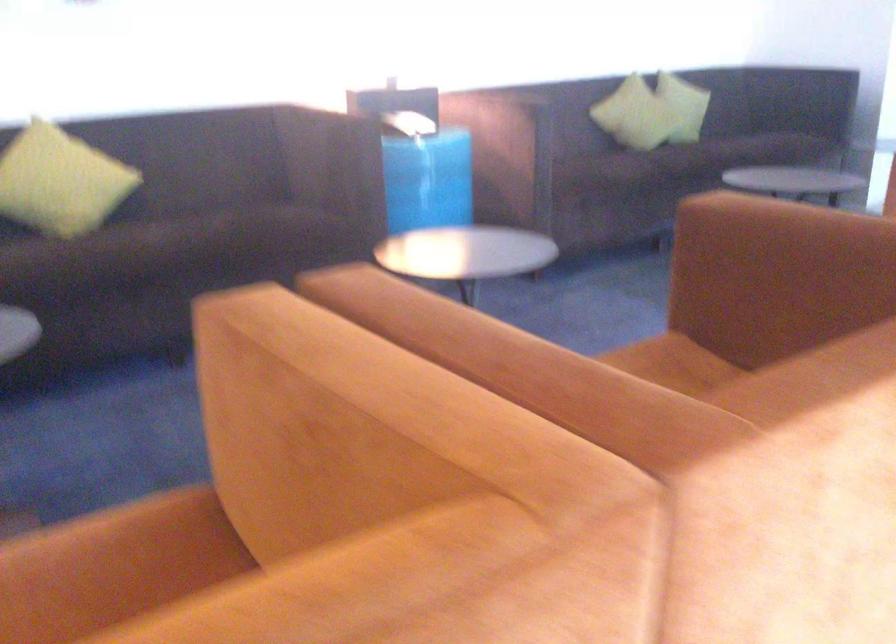
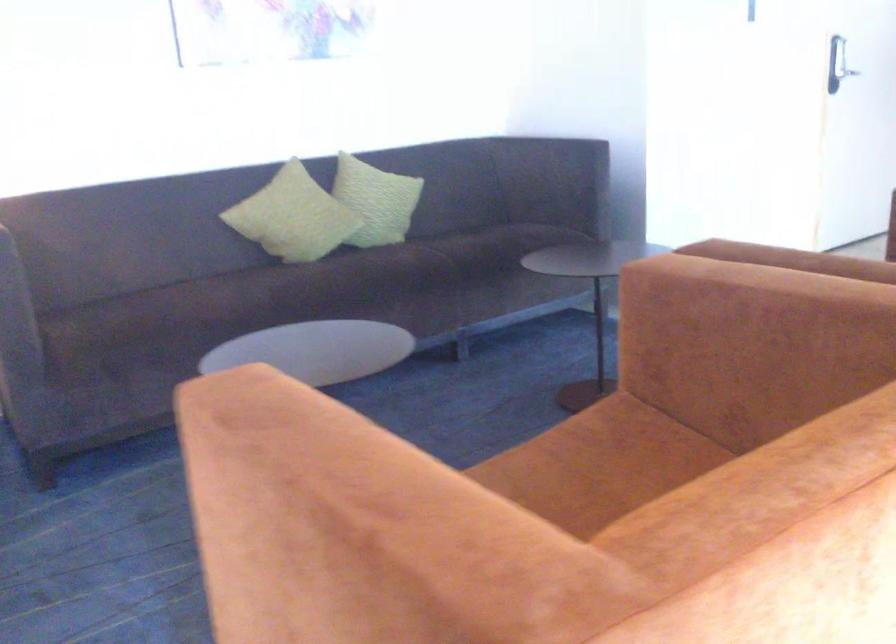
The point at (678,97) is marked in the first image. Where is the corresponding point in the second image?

(293, 216)